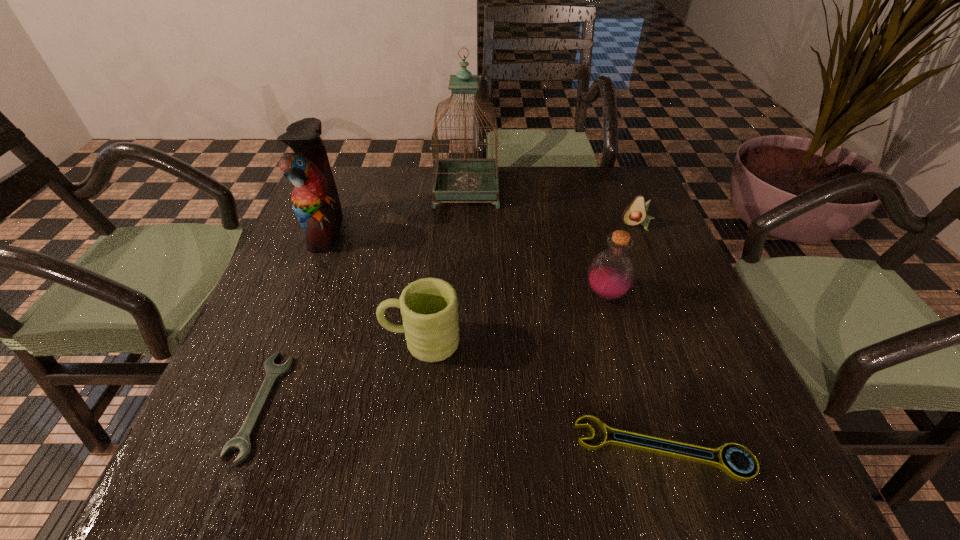
At what (x,y) coordinates should I click in order to perform the action: click on unoccupied area between the tallest object and the mug. Please return your answer as a coordinate pair (x, y). Looking at the image, I should click on (444, 266).

Where is `vacant region between the third shortest object and the mug`? This screenshot has width=960, height=540. vacant region between the third shortest object and the mug is located at coordinates (529, 284).

This screenshot has height=540, width=960. What are the coordinates of `vacant space in between the avocado and the right wrench` in the screenshot? It's located at (650, 337).

Select which object is the closest to the fourth shortest object. Please provide its 2D coordinates. Your answer should be formatted as a tuple, i.e. [(x, y)], where the tuple contains the x and y coordinates of a point satisfying the conditions above.

[(241, 441)]

Locate which object ranks third in proximity to the left wrench. Please provide its 2D coordinates. Your answer should be formatted as a tuple, i.e. [(x, y)], where the tuple contains the x and y coordinates of a point satisfying the conditions above.

[(724, 464)]

This screenshot has height=540, width=960. I want to click on blank space that satisfies the following two spatial constraints: 1. on the side of the mug with the handle; 2. on the right side of the right wrench, so click(409, 448).

This screenshot has width=960, height=540. What are the coordinates of `vacant space that satisfies the following two spatial constraints: 1. at the door of the tallest object; 2. on the left side of the fifth shortest object` in the screenshot? It's located at (x=463, y=294).

What are the coordinates of `vacant area that satisfies the following two spatial constraints: 1. at the door of the birdcage; 2. on the left side of the bottle` in the screenshot? It's located at (463, 294).

The image size is (960, 540). I want to click on vacant space that satisfies the following two spatial constraints: 1. on the seed side of the avocado; 2. on the side of the fourth shortest object with the handle, so click(x=686, y=341).

This screenshot has height=540, width=960. I want to click on free space that satisfies the following two spatial constraints: 1. on the back side of the fourth farthest object; 2. at the face of the parrot, so click(588, 230).